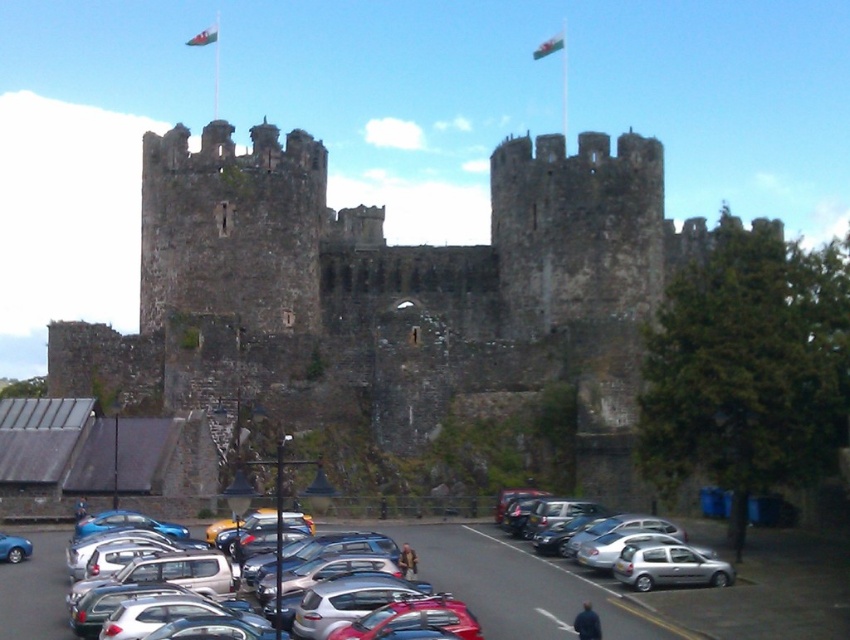
You are standing in the parking lot of the historic stone castle and notice the blue metallic car at lower left and the white fabric flag at upper center. Which object is positioned to the right of the other?

The blue metallic car at lower left is to the right of the white fabric flag at upper center.

You are a photographer planning to take a picture of the castle. You want to ensure that the silver metallic hatchback at lower right does not block the view of the green fabric flag at upper center. Based on their heights, will the hatchback obscure the flag in the photo?

The silver metallic hatchback at lower right is shorter than the green fabric flag at upper center, so it will not obscure the flag in the photo.